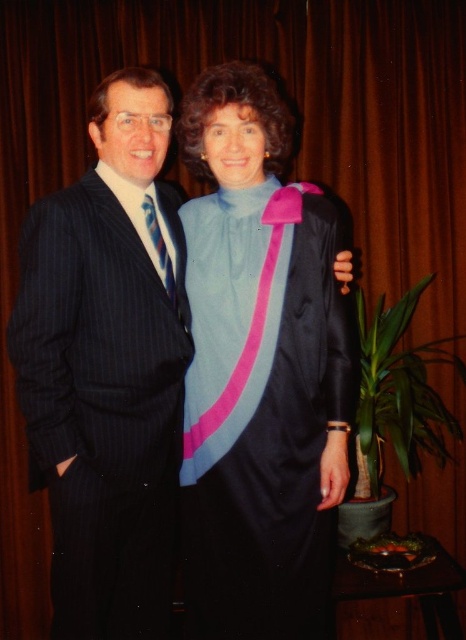
You are standing in the front row of the audience at a graduation ceremony. You want to see both the satin blue dress at center and the pinstriped suit at left clearly. Which one will appear closer to you?

The satin blue dress at center appears closer to you because it is positioned further to the viewer than the pinstriped suit at left.

You are standing in front of the graduation ceremony scene. There are two points marked in the image. Which point, point (162,157) or point (166,259), is closer to you?

Point (162,157) is closer to the viewer than point (166,259).

You are a photographer at a formal event and need to position two subjects for a group photo. The subjects are wearing the satin blue dress at center and the pinstriped suit at left. Based on their current positions, which subject should you ask to move to the left to create space for a third person entering from the right side?

The pinstriped suit at left should move to the left because the satin blue dress at center is currently positioned to the right of the pinstriped suit at left, so moving the pinstriped suit at left further left would create space on the right side for the third person entering from the right.